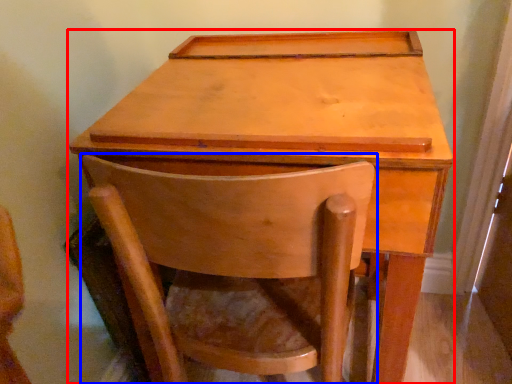
Question: Which of the following is the closest to the observer, table (highlighted by a red box) or chair (highlighted by a blue box)?

Choices:
 (A) table
 (B) chair

Answer: (B)